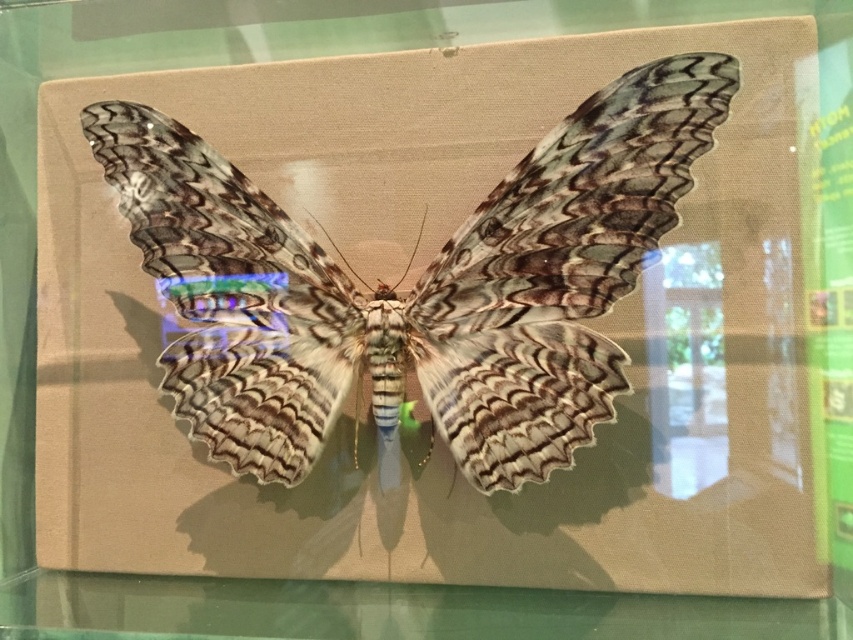
You are a museum visitor standing in front of the display case. You see the rustic wood butterfly at center and the transparent glass table at lower center. Which object is positioned to the right side of the other?

The rustic wood butterfly at center is to the right of the transparent glass table at lower center.

You are a museum curator planning to move the rustic wood butterfly at center and the transparent glass table at lower center to a new exhibition space. The new space has a height restriction of 1.2 meters. Can both items be moved without any modifications?

The rustic wood butterfly at center has a greater height compared to the transparent glass table at lower center. Since the butterfly is taller than the table, but the exact heights are not provided, it is uncertain if the butterfly exceeds the 1.2 meter restriction. Further measurements are needed to confirm.

You are a museum visitor standing in front of the display case. You notice a point marked at coordinates (415, 284). What object is located at this point?

The point at coordinates (415, 284) indicates the rustic wood butterfly at center.